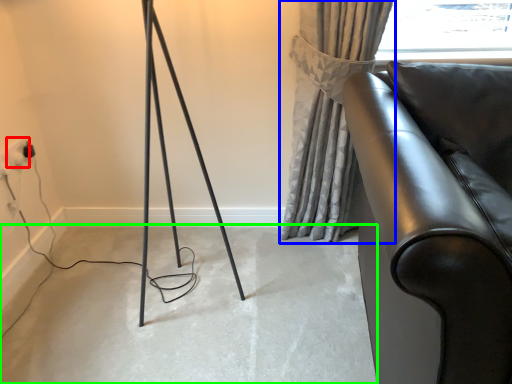
Question: Considering the real-world distances, which object is closest to electric outlet (highlighted by a red box)? curtain (highlighted by a blue box) or concrete (highlighted by a green box).

Choices:
 (A) curtain
 (B) concrete

Answer: (B)